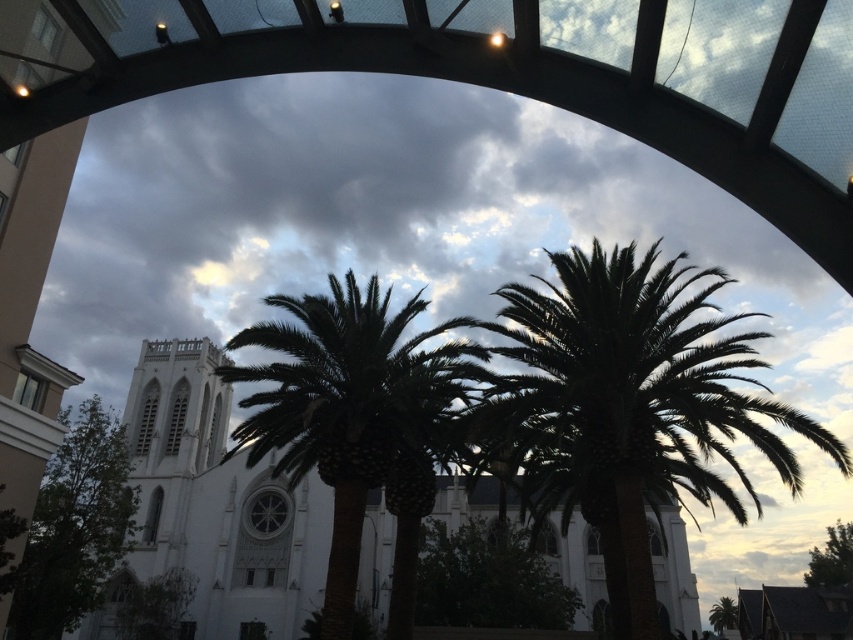
Based on the photo, you are standing at the center of the arched structure and want to take a photo of both the green leafy tree at lower left and the green leafy tree at lower right. Which direction should you face to include both trees in your photo?

You should face towards the middle between the green leafy tree at lower left and the green leafy tree at lower right since the green leafy tree at lower left is positioned to the left of the green leafy tree at lower right, so facing between them would capture both in the frame.

You are standing at the point marked by point (352,410) in the image. What do you see directly in front of you?

You see a green leafy palm tree at center directly in front of you at point (352,410).

You are standing in the scene and want to place a small decorative statue between the two points, point(695,420) and point(424,573). To ensure it is visible from where you are standing, which point should the statue be closer to?

The statue should be placed closer to point(695,420) because it is closer to the viewer than point(424,573), making it more visible from your current position.